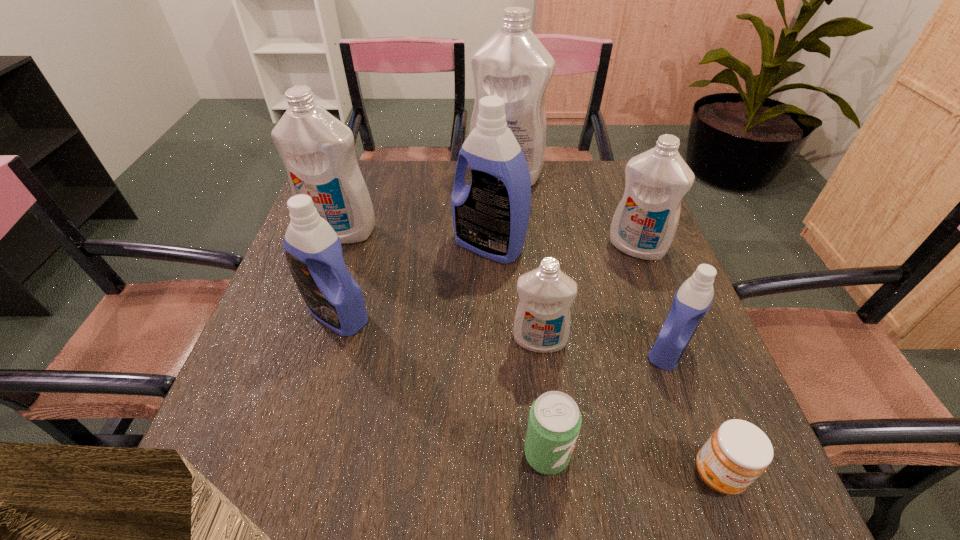
At what (x,y) coordinates should I click in order to perform the action: click on jam. Please return your answer as a coordinate pair (x, y). Looking at the image, I should click on [x=738, y=452].

Where is `the shortest object`? The height and width of the screenshot is (540, 960). the shortest object is located at coordinates (738, 452).

Where is `vacant point located on the left of the farthest detergent`? vacant point located on the left of the farthest detergent is located at coordinates coord(373,176).

Where is `free space located 0.100m on the right of the third smallest white detergent`? Image resolution: width=960 pixels, height=540 pixels. free space located 0.100m on the right of the third smallest white detergent is located at coordinates (416, 231).

Image resolution: width=960 pixels, height=540 pixels. Identify the location of free location located 0.250m on the right of the second blue detergent from left to right. (625, 246).

The image size is (960, 540). I want to click on vacant space located on the back of the rightmost white detergent, so click(624, 214).

Locate an element on the screen. Image resolution: width=960 pixels, height=540 pixels. vacant space located on the back of the leftmost blue detergent is located at coordinates (373, 194).

Identify the location of free space located on the left of the smallest white detergent. This screenshot has height=540, width=960. (415, 340).

Identify the location of vacant space located on the back of the smallest blue detergent. (619, 215).

Locate an element on the screen. This screenshot has height=540, width=960. vacant space positioned 0.340m on the back of the soda is located at coordinates (529, 289).